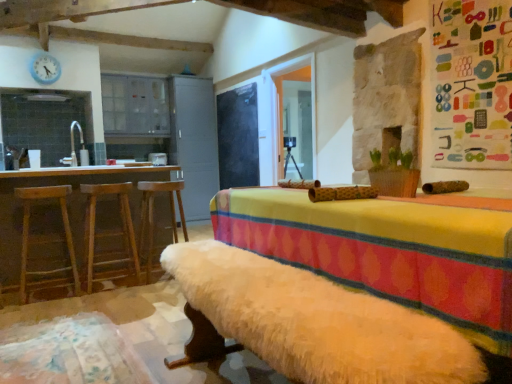
Where is `vacant space in front of wooden bar stool at left, which is the 2th bar stool in left-to-right order`? The height and width of the screenshot is (384, 512). vacant space in front of wooden bar stool at left, which is the 2th bar stool in left-to-right order is located at coordinates (93, 297).